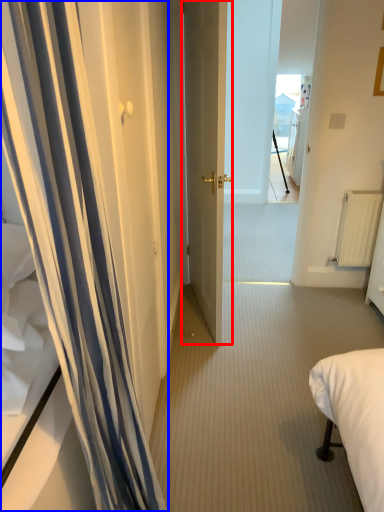
Question: Which object appears closest to the camera in this image, door (highlighted by a red box) or curtain (highlighted by a blue box)?

Choices:
 (A) door
 (B) curtain

Answer: (B)